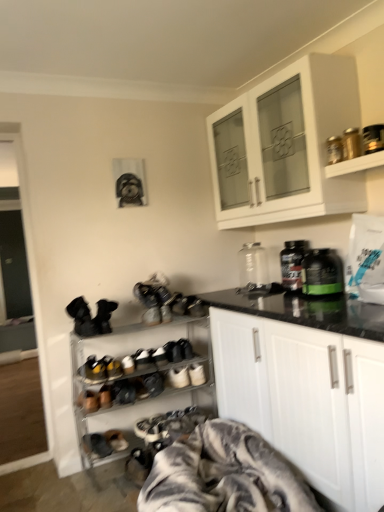
Question: Is green matte bottle at right, the 3th bottle positioned from the back, in front of or behind white matte cabinet at upper center, which is the second cabinetry in bottom-to-top order, in the image?

Choices:
 (A) front
 (B) behind

Answer: (B)

Question: Looking at the image, does green matte bottle at right, the 3th bottle positioned from the back, seem bigger or smaller compared to white matte cabinet at upper center, which is the second cabinetry in bottom-to-top order?

Choices:
 (A) small
 (B) big

Answer: (A)

Question: Which of these objects is positioned farthest from the white suede sneakers at center, marked as the 4th footwear in a bottom-to-top arrangement?

Choices:
 (A) black plastic bottle at center, the 2th bottle from the back
 (B) leather sneakers at center, which is the second footwear in right-to-left order
 (C) brown suede shoes at lower left, which appears as the 2th footwear when viewed from the top
 (D) metallic silver shoe rack at lower left, which appears as the second shelf when viewed from the right
 (E) white matte cabinet at center, which appears as the 2th cabinetry when viewed from the top

Answer: (A)

Question: Which is nearer to the white matte cabinet at center, which appears as the 2th cabinetry when viewed from the top?

Choices:
 (A) dark gray suede shoes at lower left, the third footwear from the top
 (B) metallic silver shoe rack at lower left, positioned as the second shelf in top-to-bottom order
 (C) brown suede shoes at lower left, placed as the fourth footwear when sorted from right to left
 (D) transparent glass bottle at center, which ranks as the 1th bottle in back-to-front order
 (E) metallic gold canisters at upper right, the second shelf viewed from the left

Answer: (B)